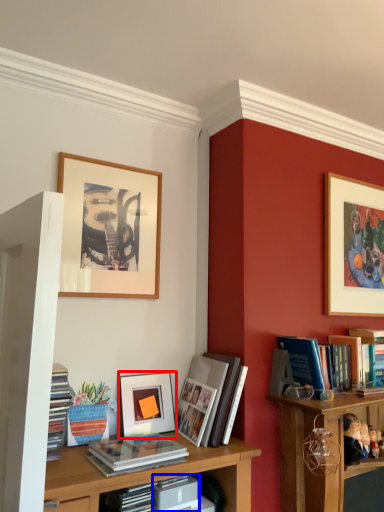
Question: Which object is further to the camera taking this photo, picture frame (highlighted by a red box) or paperback book (highlighted by a blue box)?

Choices:
 (A) picture frame
 (B) paperback book

Answer: (A)